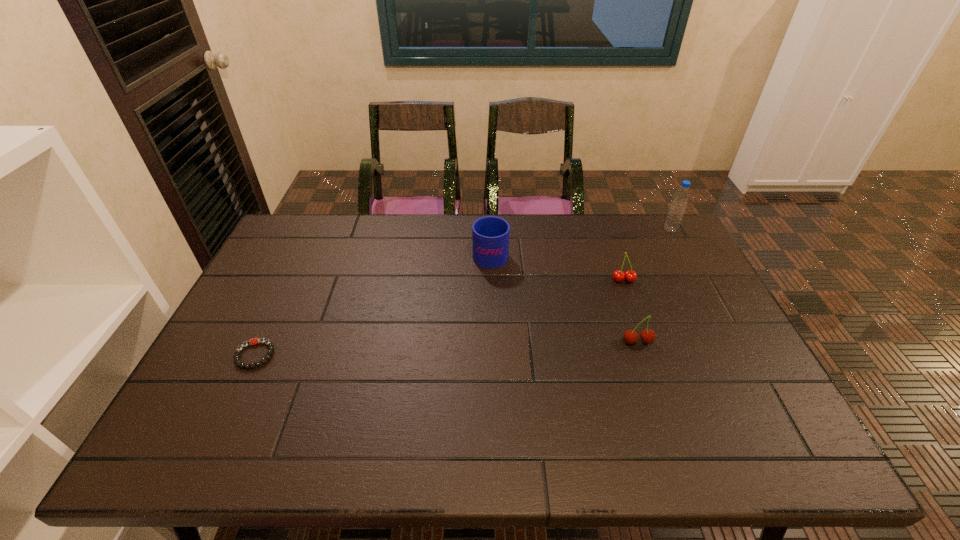
Find the location of a particular element. vacant space that's between the rightmost object and the second tallest object is located at coordinates (581, 241).

Find the location of a particular element. free point between the second farthest object and the third farthest object is located at coordinates (557, 266).

Where is `free point between the second object from left to right and the leftmost object`? This screenshot has width=960, height=540. free point between the second object from left to right and the leftmost object is located at coordinates (372, 303).

At what (x,y) coordinates should I click in order to perform the action: click on vacant area between the farthest object and the mug. Please return your answer as a coordinate pair (x, y). This screenshot has height=540, width=960. Looking at the image, I should click on (581, 241).

You are a GUI agent. You are given a task and a screenshot of the screen. Output one action in this format:
    pyautogui.click(x=<x>, y=<y>)
    Task: Click on the empty space between the mug and the nearer cherry
    This screenshot has height=540, width=960.
    Given the screenshot: What is the action you would take?
    pyautogui.click(x=564, y=297)

Select which object is the fourth closest to the second tallest object. Please provide its 2D coordinates. Your answer should be formatted as a tuple, i.e. [(x, y)], where the tuple contains the x and y coordinates of a point satisfying the conditions above.

[(253, 341)]

Identify which object is located as the third nearest to the nearer cherry. Please provide its 2D coordinates. Your answer should be formatted as a tuple, i.e. [(x, y)], where the tuple contains the x and y coordinates of a point satisfying the conditions above.

[(678, 205)]